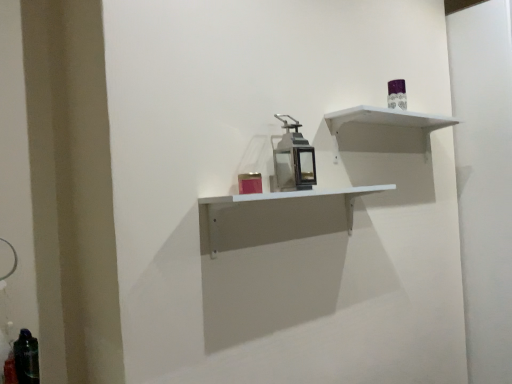
Question: Could metallic lantern at center be considered to be inside white matte shelf at center, the 1th shelf from the bottom?

Choices:
 (A) yes
 (B) no

Answer: (B)

Question: Considering the relative sizes of white matte shelf at center, the second shelf viewed from the top, and metallic lantern at center in the image provided, is white matte shelf at center, the second shelf viewed from the top, bigger than metallic lantern at center?

Choices:
 (A) no
 (B) yes

Answer: (B)

Question: From the image's perspective, is white matte shelf at center, the second shelf viewed from the top, above metallic lantern at center?

Choices:
 (A) no
 (B) yes

Answer: (A)

Question: From a real-world perspective, is white matte shelf at center, the second shelf viewed from the top, below metallic lantern at center?

Choices:
 (A) no
 (B) yes

Answer: (B)

Question: Is white matte shelf at center, the second shelf viewed from the top, shorter than metallic lantern at center?

Choices:
 (A) yes
 (B) no

Answer: (A)

Question: Considering the positions of metallic lantern at center and white matte shelf at center, the 1th shelf from the bottom, in the image, is metallic lantern at center taller or shorter than white matte shelf at center, the 1th shelf from the bottom,?

Choices:
 (A) short
 (B) tall

Answer: (B)

Question: From the image's perspective, is metallic lantern at center positioned above or below white matte shelf at center, the second shelf viewed from the top?

Choices:
 (A) below
 (B) above

Answer: (B)

Question: From a real-world perspective, is metallic lantern at center positioned above or below white matte shelf at center, the second shelf viewed from the top?

Choices:
 (A) above
 (B) below

Answer: (A)

Question: Based on their sizes in the image, would you say metallic lantern at center is bigger or smaller than white matte shelf at center, the 1th shelf from the bottom?

Choices:
 (A) big
 (B) small

Answer: (B)

Question: Considering the positions of translucent dark green bottle at lower left and metallic lantern at center in the image, is translucent dark green bottle at lower left wider or thinner than metallic lantern at center?

Choices:
 (A) thin
 (B) wide

Answer: (A)

Question: Is translucent dark green bottle at lower left taller or shorter than metallic lantern at center?

Choices:
 (A) tall
 (B) short

Answer: (B)

Question: From a real-world perspective, is translucent dark green bottle at lower left positioned above or below metallic lantern at center?

Choices:
 (A) above
 (B) below

Answer: (B)

Question: Does point 27,344 appear closer or farther from the camera than point 295,137?

Choices:
 (A) farther
 (B) closer

Answer: (B)

Question: From the image's perspective, is metallic lantern at center above or below translucent dark green bottle at lower left?

Choices:
 (A) above
 (B) below

Answer: (A)

Question: From their relative heights in the image, would you say metallic lantern at center is taller or shorter than translucent dark green bottle at lower left?

Choices:
 (A) short
 (B) tall

Answer: (B)